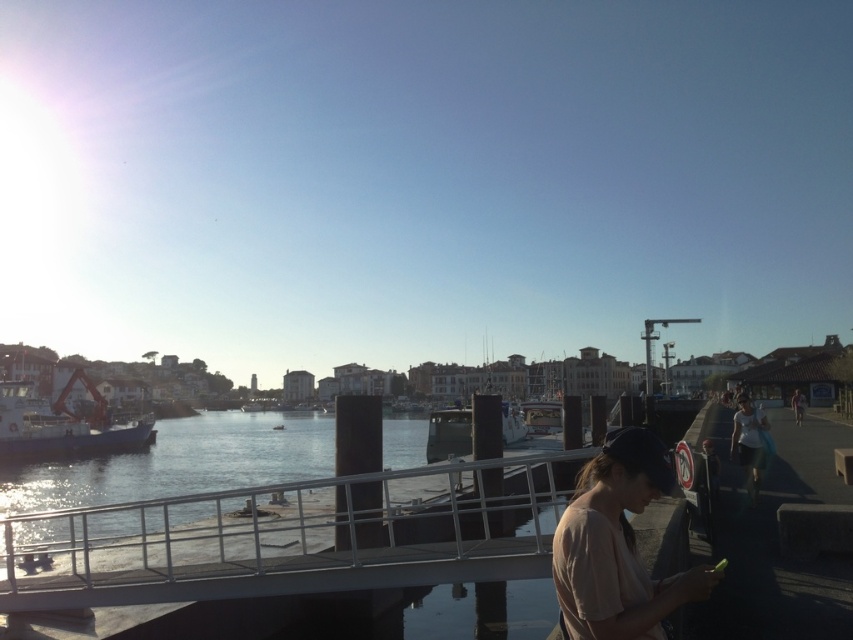
Which of these two, white glossy boat at center or light brown leather jacket at lower right, stands shorter?

With less height is light brown leather jacket at lower right.

The image size is (853, 640). What do you see at coordinates (448, 433) in the screenshot? I see `white glossy boat at center` at bounding box center [448, 433].

This screenshot has height=640, width=853. What are the coordinates of `white glossy boat at center` in the screenshot? It's located at (448, 433).

Between point (643, 608) and point (39, 435), which one is positioned in front?

Positioned in front is point (643, 608).

Is light brown cotton shirt at lower right positioned behind blue matte boat at left?

That is False.

Find the location of `light brown cotton shirt at lower right`. light brown cotton shirt at lower right is located at coordinates (618, 545).

The image size is (853, 640). Find the location of `light brown cotton shirt at lower right`. light brown cotton shirt at lower right is located at coordinates (618, 545).

Looking at this image, is blue matte boat at left bigger than light brown leather jacket at lower right?

Correct, blue matte boat at left is larger in size than light brown leather jacket at lower right.

Is blue matte boat at left in front of light brown leather jacket at lower right?

No, it is not.

Locate an element on the screen. blue matte boat at left is located at coordinates (64, 426).